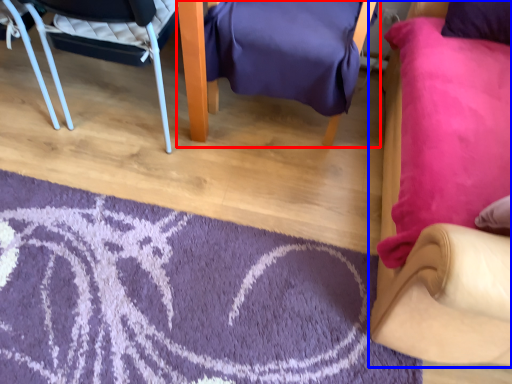
Question: Which of the following is the closest to the observer, chair (highlighted by a red box) or chair (highlighted by a blue box)?

Choices:
 (A) chair
 (B) chair

Answer: (B)